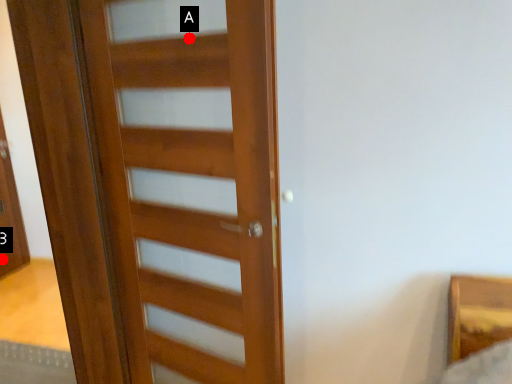
Question: Two points are circled on the image, labeled by A and B beside each circle. Which point is farther to the camera?

Choices:
 (A) A is further
 (B) B is further

Answer: (B)